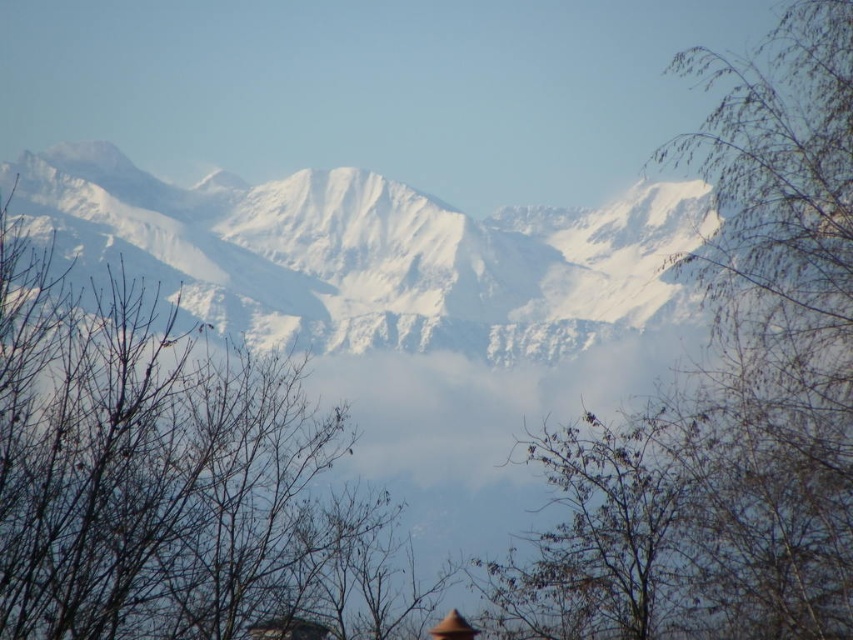
Question: Which point is farther from the camera taking this photo?

Choices:
 (A) (802, 465)
 (B) (111, 461)

Answer: (A)

Question: Is bare branches at upper right behind bare branches at center?

Choices:
 (A) no
 (B) yes

Answer: (B)

Question: From the image, what is the correct spatial relationship of bare branches at upper right in relation to bare branches at center?

Choices:
 (A) below
 (B) above

Answer: (B)

Question: Does bare branches at upper right have a smaller size compared to bare branches at center?

Choices:
 (A) no
 (B) yes

Answer: (B)